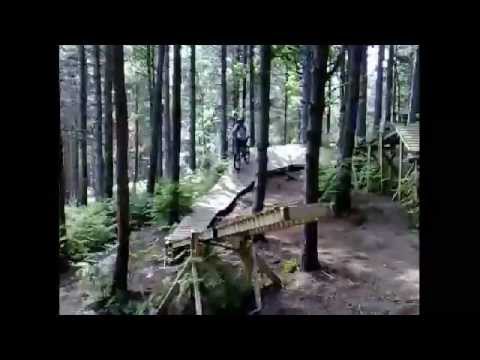
The height and width of the screenshot is (360, 480). I want to click on wood planks, so 280,157, 199,220.